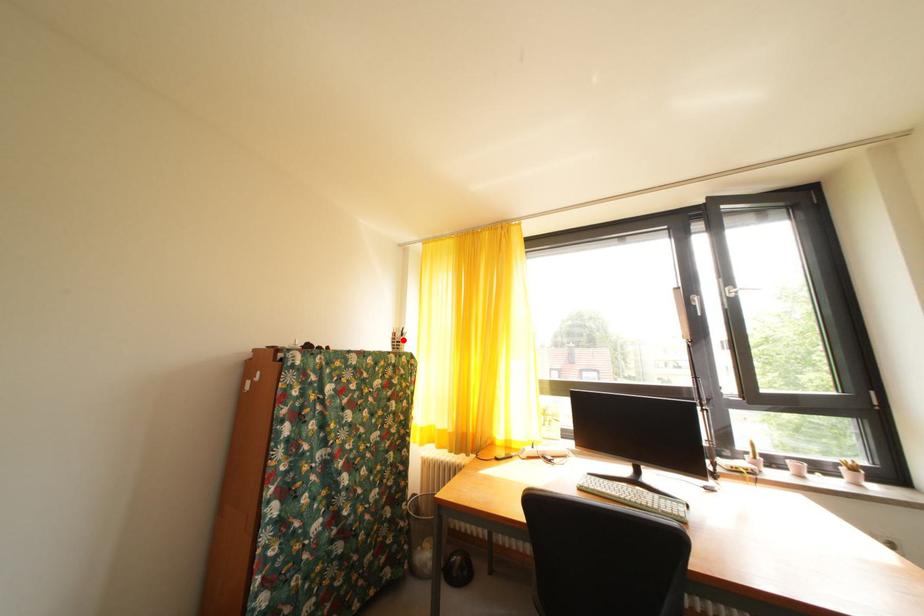
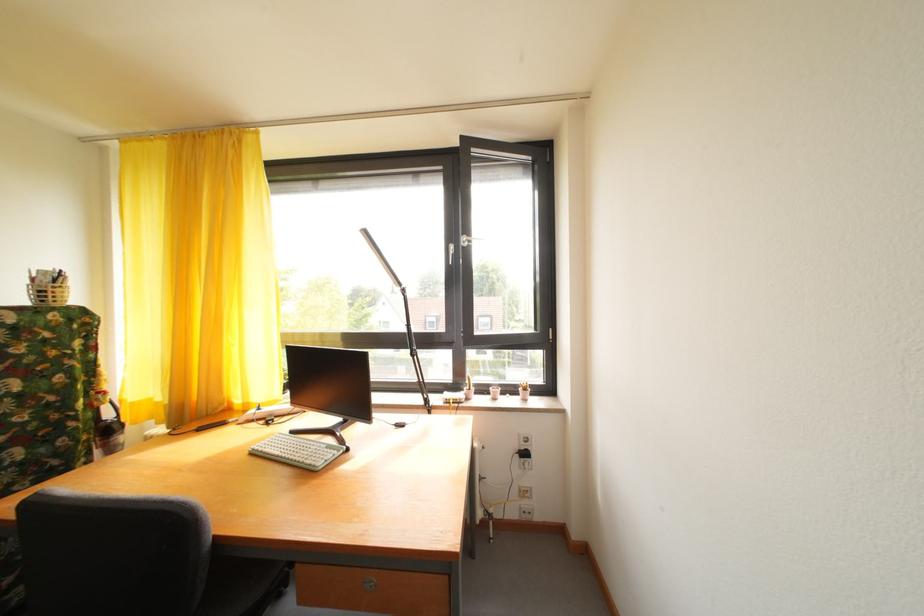
Find the pixel in the second image that matches the highlighted location in the first image.

(43, 286)